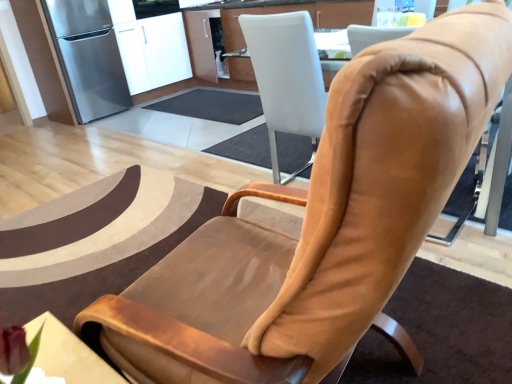
In order to face stainless steel refrigerator at left, should I rotate leftwards or rightwards?

Turn left by 21.525 degrees to look at stainless steel refrigerator at left.

The width and height of the screenshot is (512, 384). What do you see at coordinates (88, 57) in the screenshot? I see `stainless steel refrigerator at left` at bounding box center [88, 57].

You are a GUI agent. You are given a task and a screenshot of the screen. Output one action in this format:
    pyautogui.click(x=<x>, y=<y>)
    Task: Click on the stainless steel refrigerator at left
    The height and width of the screenshot is (384, 512).
    Given the screenshot: What is the action you would take?
    pyautogui.click(x=88, y=57)

This screenshot has height=384, width=512. Identify the location of stainless steel refrigerator at left. (88, 57).